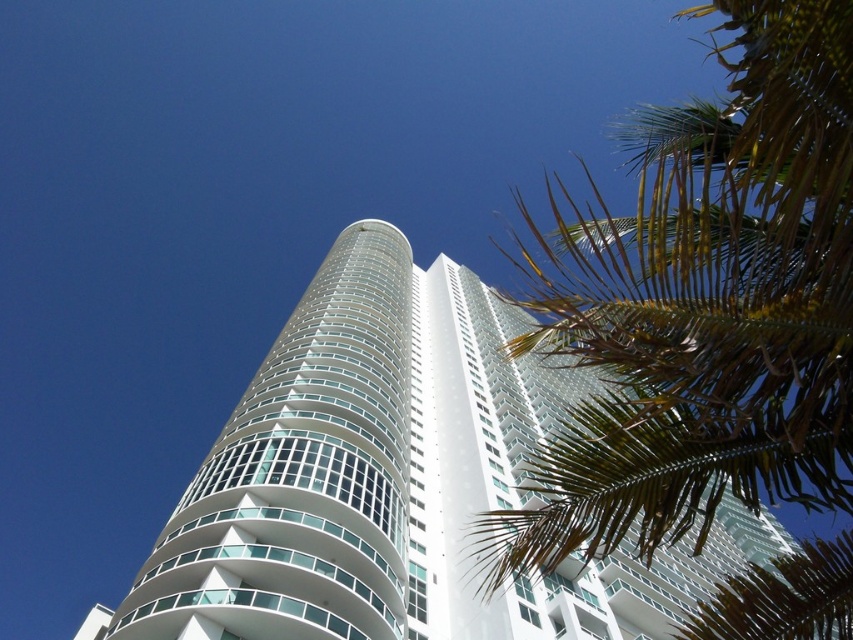
Looking at this image, which is more to the left, green leafy palm tree at upper right or white glass building at center?

From the viewer's perspective, white glass building at center appears more on the left side.

From the picture: Can you confirm if green leafy palm tree at upper right is smaller than white glass building at center?

No, green leafy palm tree at upper right is not smaller than white glass building at center.

You are a GUI agent. You are given a task and a screenshot of the screen. Output one action in this format:
    pyautogui.click(x=<x>, y=<y>)
    Task: Click on the green leafy palm tree at upper right
    The width and height of the screenshot is (853, 640).
    Given the screenshot: What is the action you would take?
    pyautogui.click(x=705, y=307)